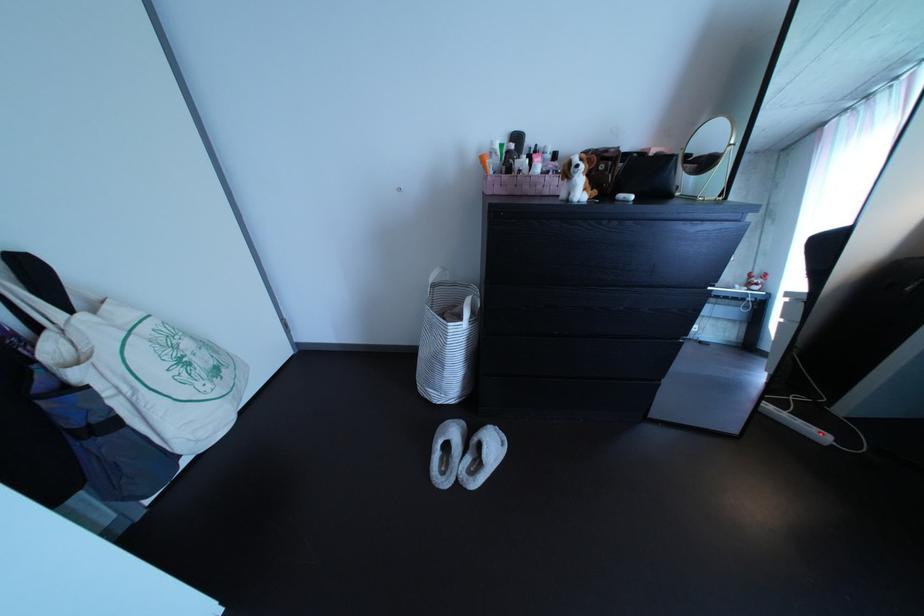
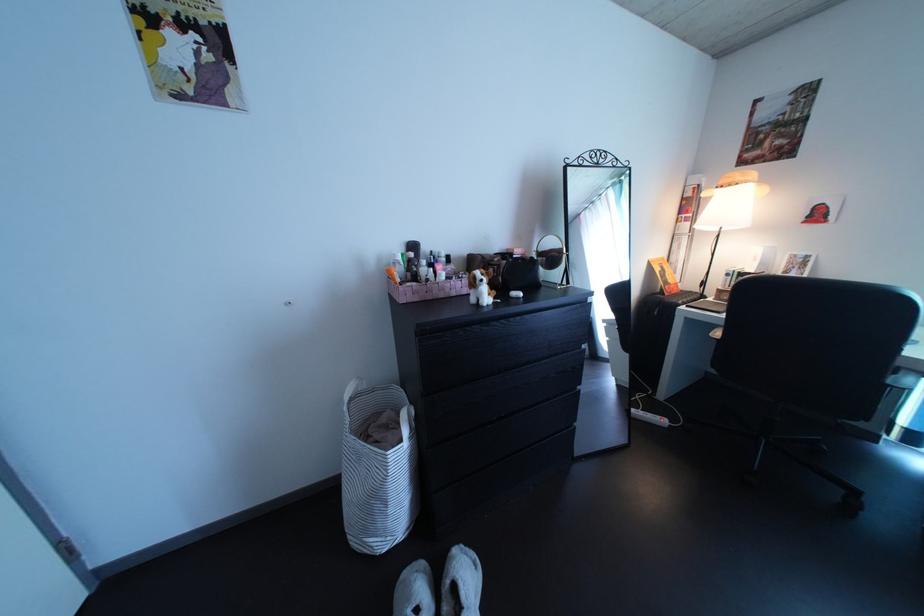
Locate, in the second image, the point that corresponds to (487,166) in the first image.

(386, 273)